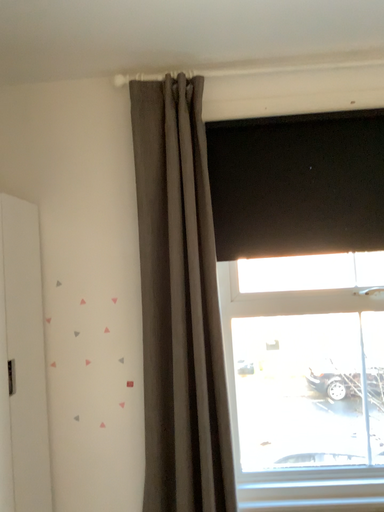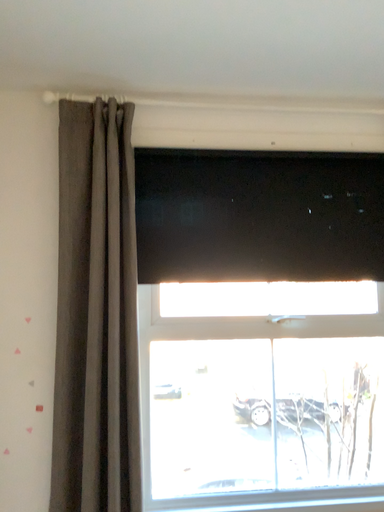
Question: Which way did the camera rotate in the video?

Choices:
 (A) rotated left
 (B) rotated right

Answer: (B)